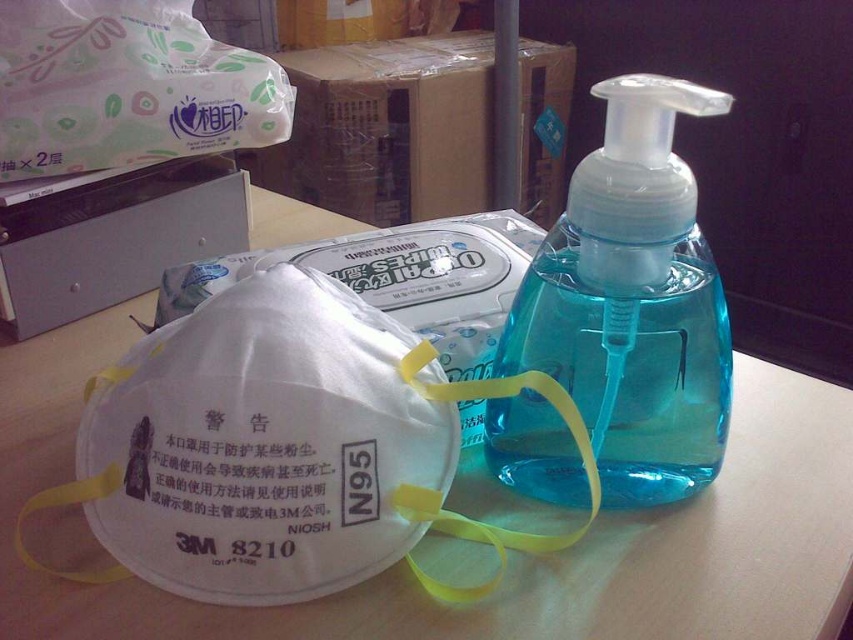
You are a worker who needs to disinfect your hands before starting work. You see the white plastic mask at center and the blue translucent plastic bottle at center on your desk. Which item should you use for hand disinfection?

The blue translucent plastic bottle at center contains a blue liquid, likely disinfectant, so you should use the blue translucent plastic bottle at center for hand disinfection.

From the picture: You are organizing items on a desk and need to place the white plastic mask at center and the blue translucent plastic bottle at center in a specific order. According to the image, which item is positioned to the left of the other?

The white plastic mask at center is to the left of blue translucent plastic bottle at center.

You are organizing items on a desk and need to place the white plastic mask at center and the blue translucent plastic bottle at center. According to the image, which item is positioned lower on the desk?

The white plastic mask at center is positioned lower than the blue translucent plastic bottle at center on the desk.